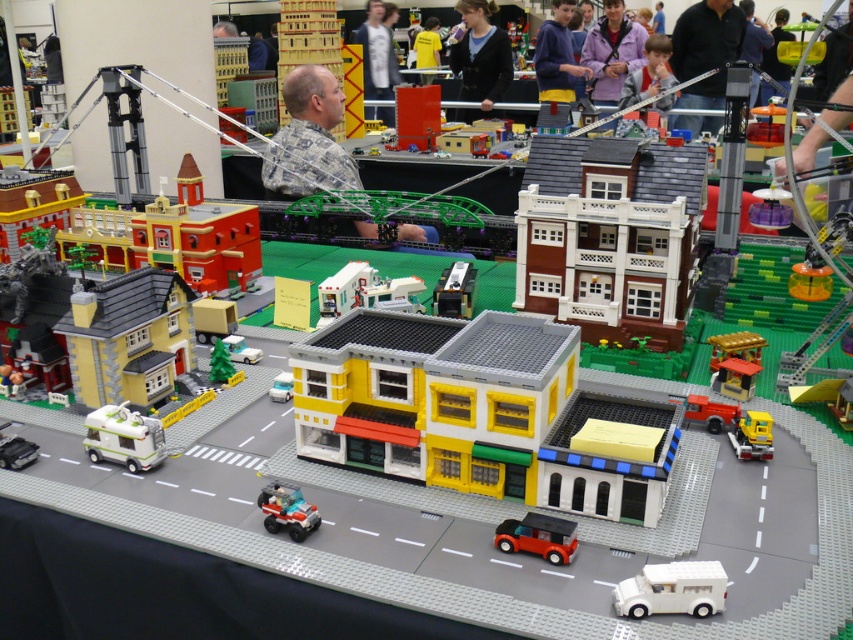
Is point (688, 412) positioned in front of point (424, 52)?

That is True.

Can you confirm if red plastic fire truck at center is wider than yellow jersey at center?

No, red plastic fire truck at center is not wider than yellow jersey at center.

Image resolution: width=853 pixels, height=640 pixels. I want to click on red plastic fire truck at center, so click(x=709, y=413).

Where is `red plastic fire truck at center`? This screenshot has height=640, width=853. red plastic fire truck at center is located at coordinates (709, 413).

Does shiny red car at lower center have a lesser height compared to yellow plastic truck at lower right?

Correct, shiny red car at lower center is not as tall as yellow plastic truck at lower right.

Who is positioned more to the right, shiny red car at lower center or yellow plastic truck at lower right?

From the viewer's perspective, yellow plastic truck at lower right appears more on the right side.

Who is more distant from viewer, (556, 552) or (764, 412)?

Point (764, 412)

At what (x,y) coordinates should I click in order to perform the action: click on shiny red car at lower center. Please return your answer as a coordinate pair (x, y). This screenshot has height=640, width=853. Looking at the image, I should click on (538, 536).

Which of these two, white plastic camper van at lower left or white plastic car at center, stands shorter?

white plastic car at center is shorter.

Is white plastic camper van at lower left to the right of white plastic car at center from the viewer's perspective?

Incorrect, white plastic camper van at lower left is not on the right side of white plastic car at center.

Which is behind, point (125, 428) or point (282, 381)?

The point (282, 381) is more distant.

Where is `white plastic camper van at lower left`? This screenshot has height=640, width=853. white plastic camper van at lower left is located at coordinates point(123,436).